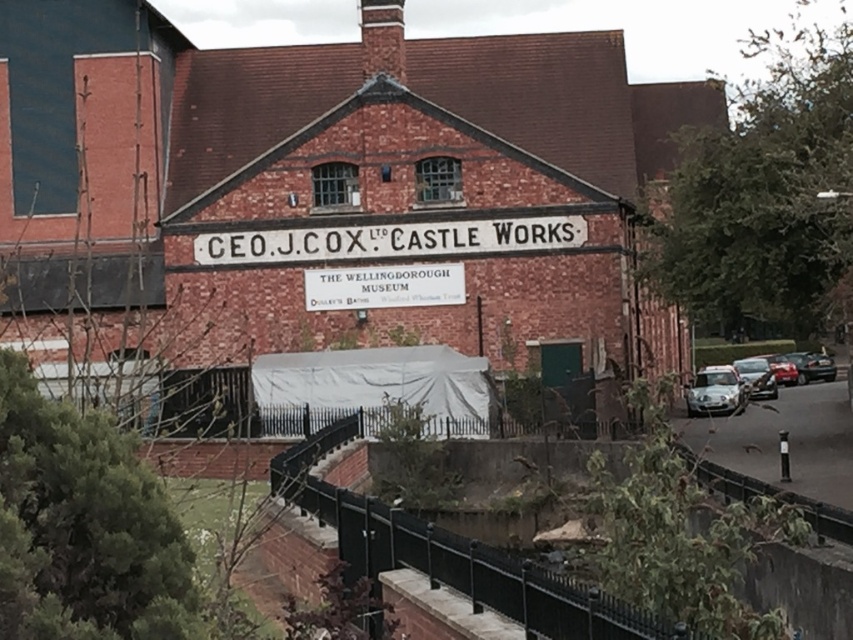
You are a visitor approaching the building and see the white paper sign at center and the metallic silver car at right. Which object is positioned higher in the scene?

The white paper sign at center is located above the metallic silver car at right, so it is positioned higher in the scene.

You are standing in front of the brick building and need to find the white paper sign at center. According to the scene description, where exactly should you look to locate it?

The white paper sign at center is located at point coordinates (383, 285).

You are standing at the entrance of the building and need to park your car. There is a silver metallic car at right. Based on its position, can you determine if there is enough space to park your vehicle on the right side of the building?

The silver metallic car at right is located at point (714, 392), which indicates its position relative to the entrance. However, without knowing the dimensions of the parking area or the size of your vehicle, it is impossible to determine if there is enough space to park on the right side of the building.